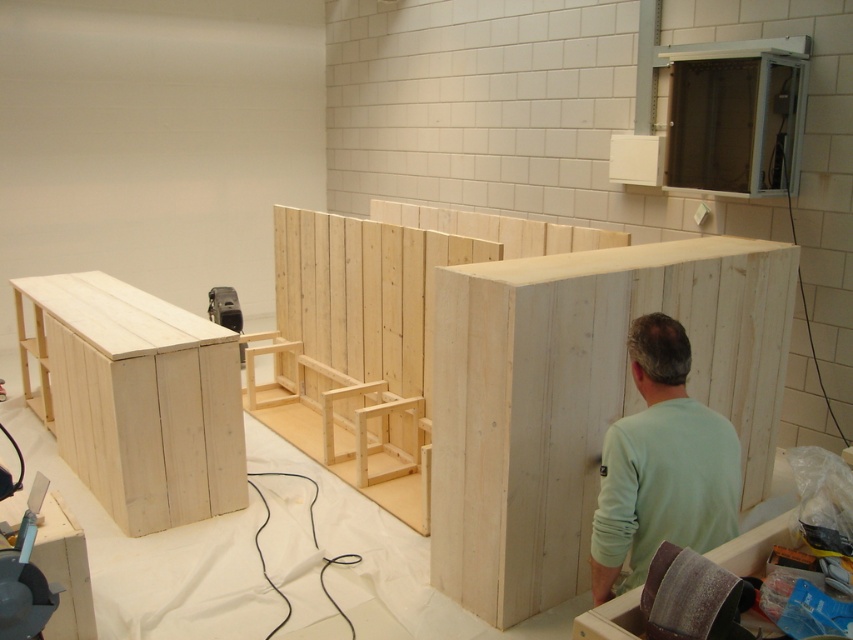
You are an interior designer planning to place a sofa in this workspace. You see the natural wood cabinet at center and the light green fabric at center. According to the spatial arrangement, which object should be placed to the left of the sofa to maintain symmetry?

The light green fabric at center should be placed to the left of the sofa because the natural wood cabinet at center is positioned on the right side of it, creating a symmetrical layout.

You are standing in the workshop and see the point at coordinates (x=579, y=397). Which object is this point located on?

The point at coordinates (x=579, y=397) is located on the natural wood cabinet at center.